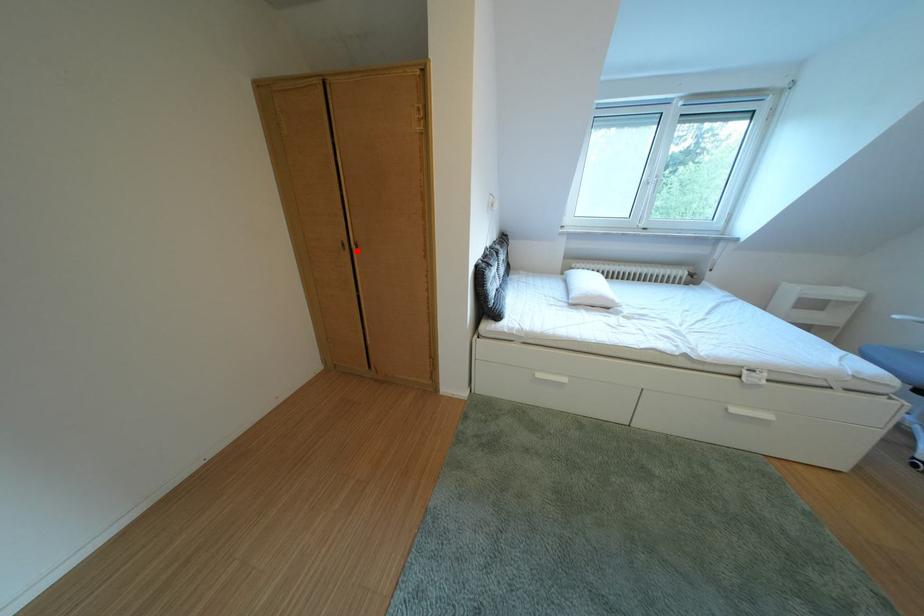
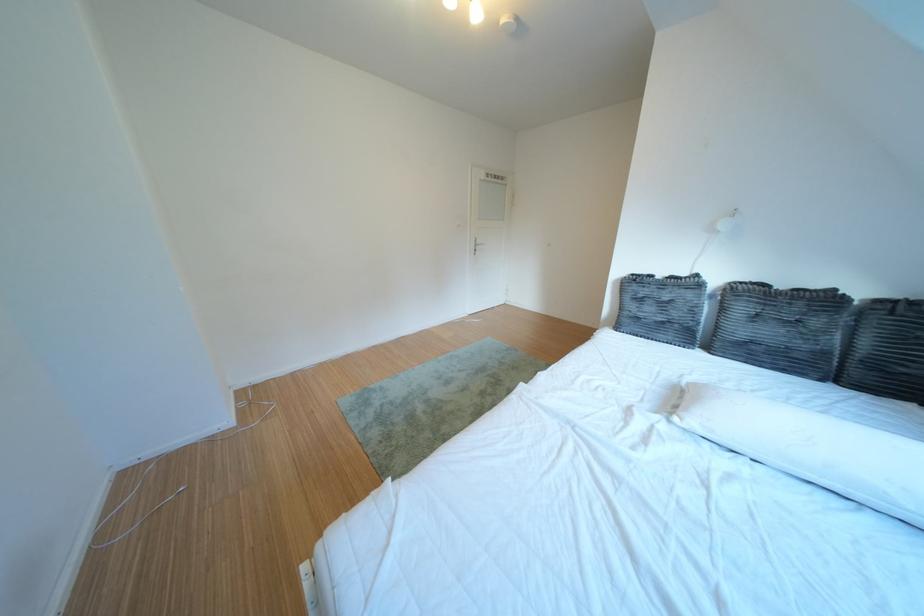
Question: I am providing you with two images of the same scene from different viewpoints. A red point is marked on the first image. Is the red point's position out of view in image 2?

Choices:
 (A) Yes
 (B) No

Answer: (A)